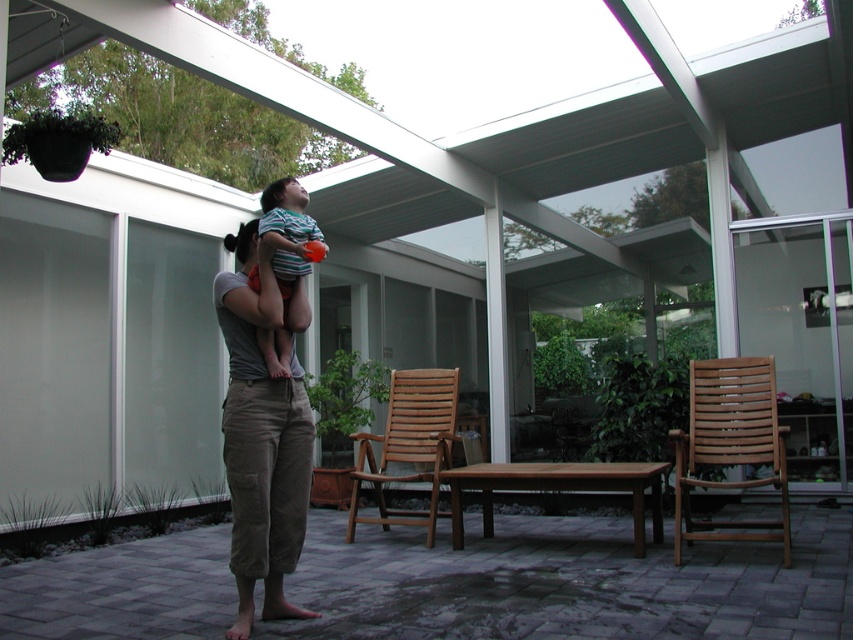
What are the coordinates of the khaki cotton pants at center?

The khaki cotton pants at center are located at coordinates point (262, 435).

Consider the image. You are a fashion designer observing the outdoor patio scene. You notice the khaki cotton pants at center and the striped cotton shirt at center. Based on their positions, which clothing item is closer to the ground?

The khaki cotton pants at center is below striped cotton shirt at center, so the khaki cotton pants at center is closer to the ground.